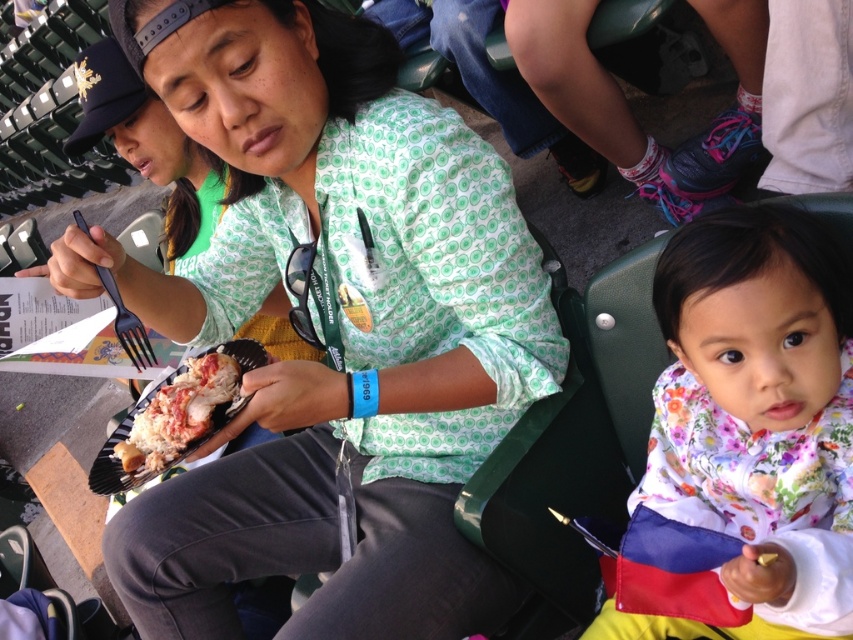
Question: Which point is closer to the camera?

Choices:
 (A) (230, 612)
 (B) (184, 420)

Answer: (B)

Question: Can you confirm if shiny lobster at center is smaller than black plastic fork at center?

Choices:
 (A) no
 (B) yes

Answer: (B)

Question: Can you confirm if floral fabric baby at center is positioned above black plastic fork at center?

Choices:
 (A) yes
 (B) no

Answer: (B)

Question: Is matte green shirt at center smaller than black plastic fork at center?

Choices:
 (A) no
 (B) yes

Answer: (A)

Question: Considering the real-world distances, which object is closest to the shiny lobster at center?

Choices:
 (A) black plastic fork at center
 (B) matte green shirt at center
 (C) floral fabric baby at center

Answer: (A)

Question: Based on their relative distances, which object is nearer to the shiny lobster at center?

Choices:
 (A) black plastic fork at center
 (B) matte green shirt at center

Answer: (A)